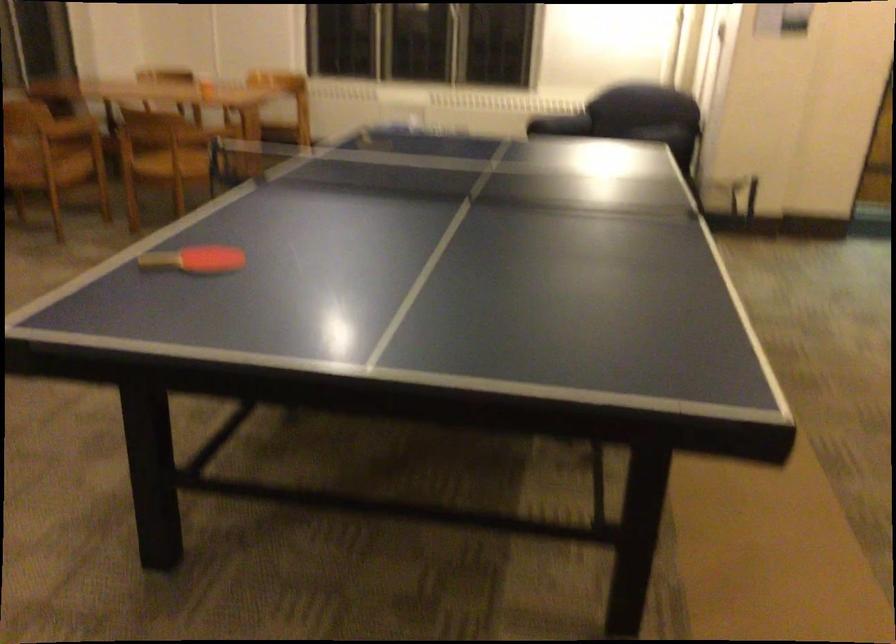
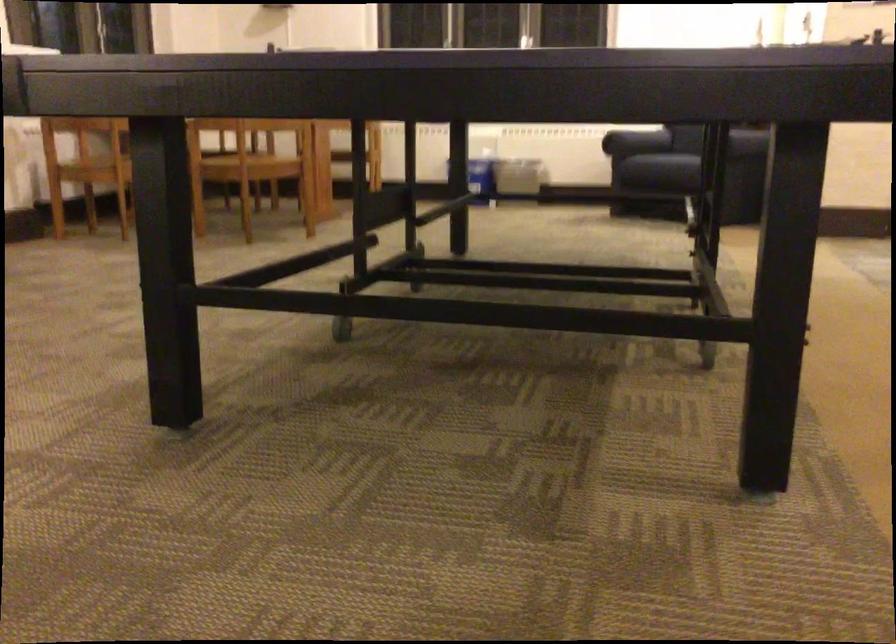
Question: What movement of the cameraman would produce the second image?

Choices:
 (A) Left
 (B) Right
 (C) Forward
 (D) Backward

Answer: (C)